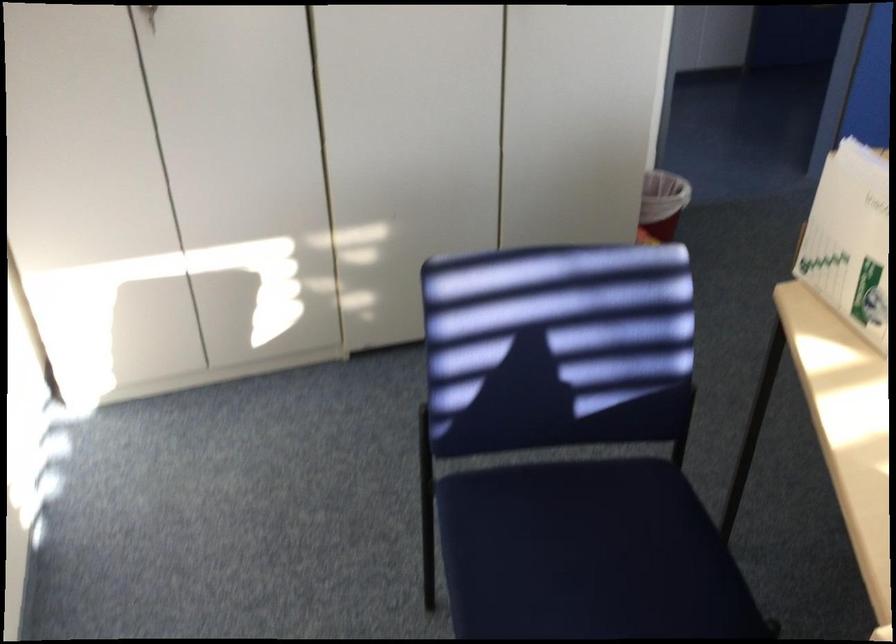
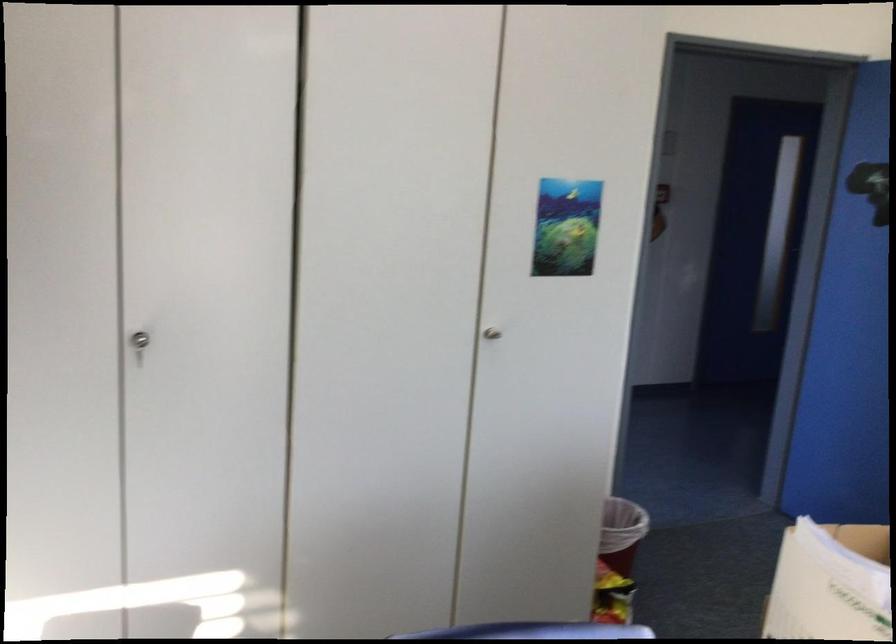
Question: The images are taken continuously from a first-person perspective. In which direction is your viewpoint rotating?

Choices:
 (A) Left
 (B) Right
 (C) Up
 (D) Down

Answer: (C)